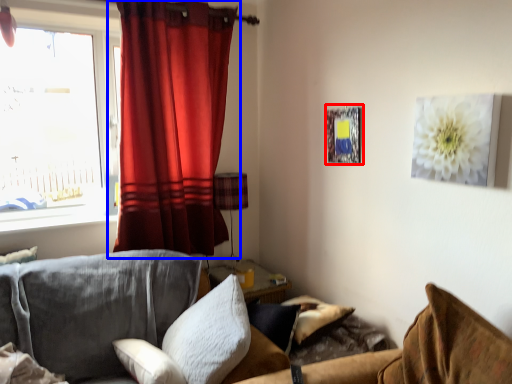
Question: Which of the following is the farthest to the observer, picture frame (highlighted by a red box) or curtain (highlighted by a blue box)?

Choices:
 (A) picture frame
 (B) curtain

Answer: (B)